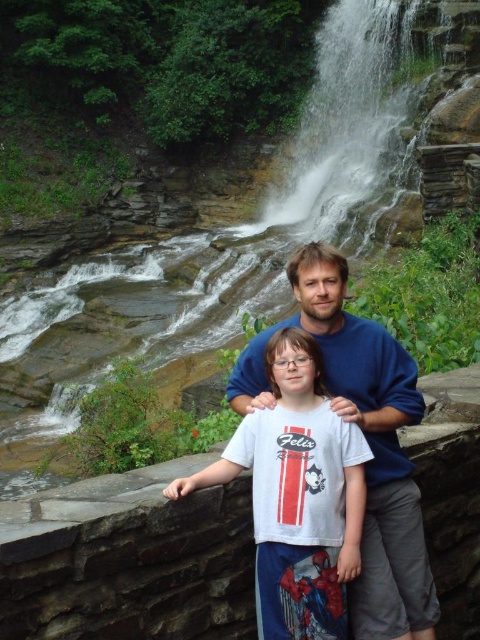
Question: Among these objects, which one is farthest from the camera?

Choices:
 (A) white cotton shirt at center
 (B) blue cotton shirt at center

Answer: (A)

Question: Can you confirm if white cotton shirt at center is wider than blue cotton shirt at center?

Choices:
 (A) yes
 (B) no

Answer: (B)

Question: Which point is closer to the camera?

Choices:
 (A) (241, 368)
 (B) (321, 609)

Answer: (B)

Question: Is the position of white cotton shirt at center less distant than that of blue cotton shirt at center?

Choices:
 (A) yes
 (B) no

Answer: (B)

Question: Does white cotton shirt at center have a lesser width compared to blue cotton shirt at center?

Choices:
 (A) yes
 (B) no

Answer: (A)